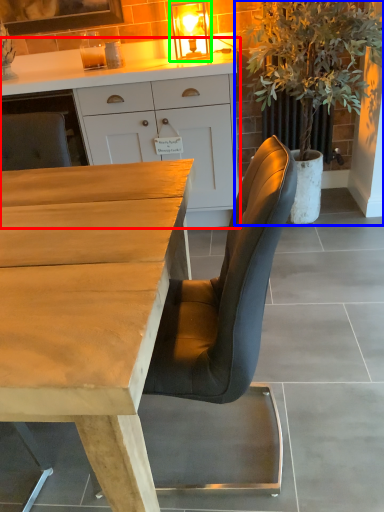
Question: Which object is the farthest from cabinetry (highlighted by a red box)? Choose among these: houseplant (highlighted by a blue box) or light fixture (highlighted by a green box).

Choices:
 (A) houseplant
 (B) light fixture

Answer: (A)